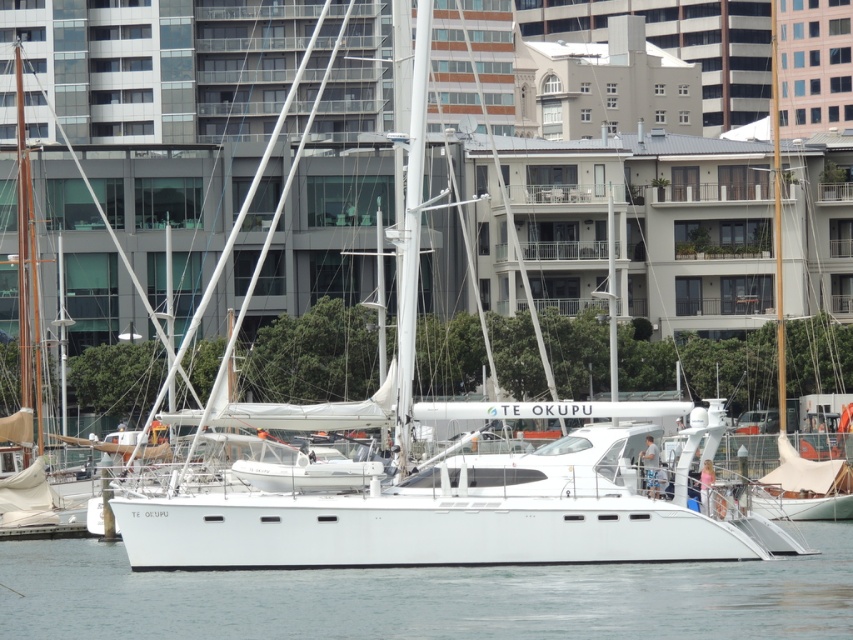
You are a photographer planning to capture the reflection of the white smooth water at center and the white matte sailboat at right in the marina. Since you want the reflection of the water to be more prominent than the sailboat, which object should you focus on adjusting the camera settings for?

The white smooth water at center has a smaller size compared to the white matte sailboat at right, so to make its reflection more prominent, you should focus on adjusting the camera settings to emphasize the smaller white smooth water at center.

You are standing on the deck of the TE OKUPU catamaran and want to take a photo of two specific points marked on the boat. The first point is at coordinates point (274, 614) and the second is at point (778, 396). Which point will appear larger in your photo?

Point (274, 614) is closer to the camera than point (778, 396), so it will appear larger in the photo.

You are standing on the dock and see the white smooth water at center and the white matte sailboat at right. Which object is closer to your right side?

The white matte sailboat at right is closer to your right side because it is positioned to the right of the white smooth water at center.